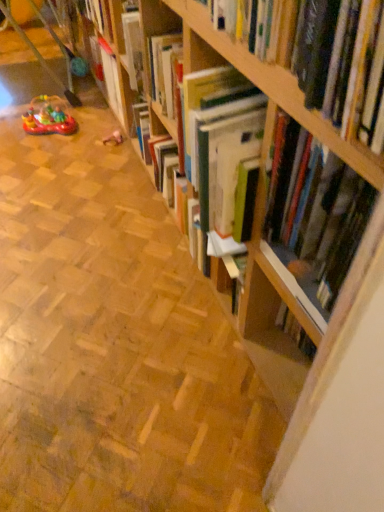
Identify the location of vacant space that's between rubberized plastic toy at center, which is the first toy in right-to-left order, and wooden bookcase at upper right. This screenshot has height=512, width=384. (152, 317).